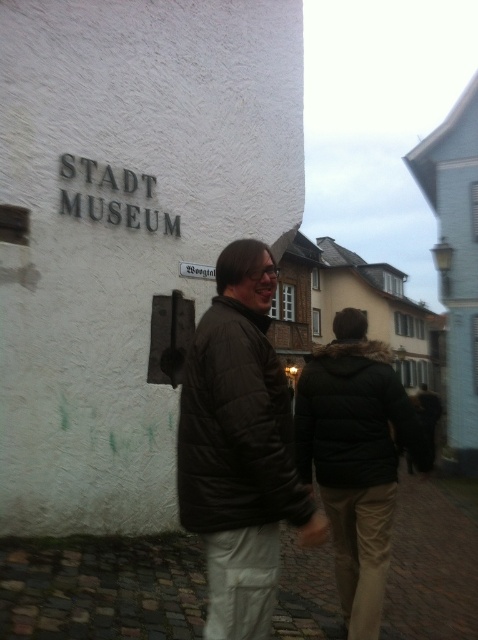
Is dark brown quilted jacket at center bigger than white plastic sign at center?

Yes.

The image size is (478, 640). In order to click on dark brown quilted jacket at center in this screenshot , I will do `click(239, 448)`.

Between dark brown quilted jacket at center and dark green jacket at center, which one has less height?

Standing shorter between the two is dark brown quilted jacket at center.

Is point (232, 387) closer to viewer compared to point (322, 387)?

Yes, point (232, 387) is closer to viewer.

Locate an element on the screen. The image size is (478, 640). dark brown quilted jacket at center is located at coordinates (239, 448).

Which is behind, point (380, 388) or point (214, 275)?

Positioned behind is point (214, 275).

Does point (310, 410) come farther from viewer compared to point (204, 268)?

No, (310, 410) is closer to viewer.

Is point (344, 400) farther from camera compared to point (185, 273)?

No, it is in front of (185, 273).

The width and height of the screenshot is (478, 640). I want to click on dark green jacket at center, so click(357, 458).